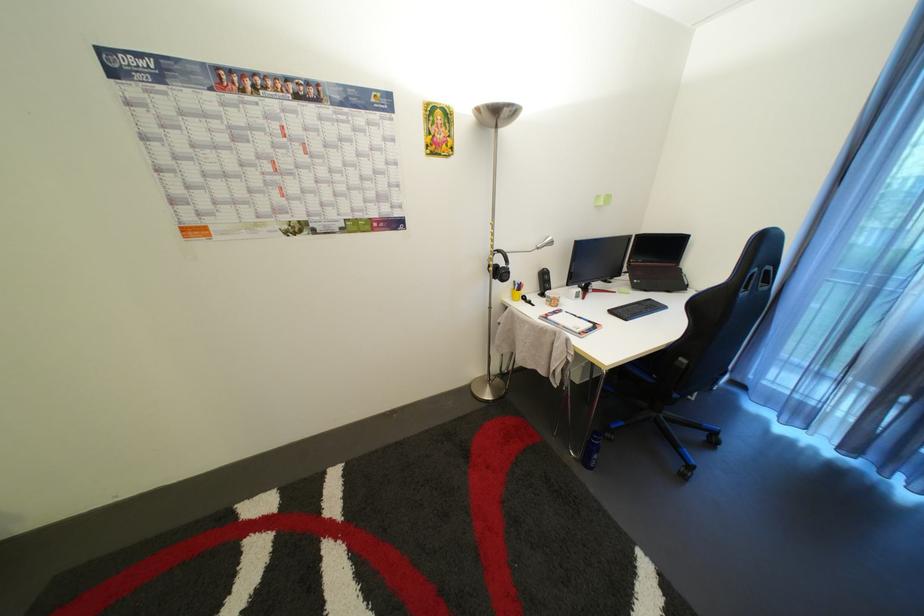
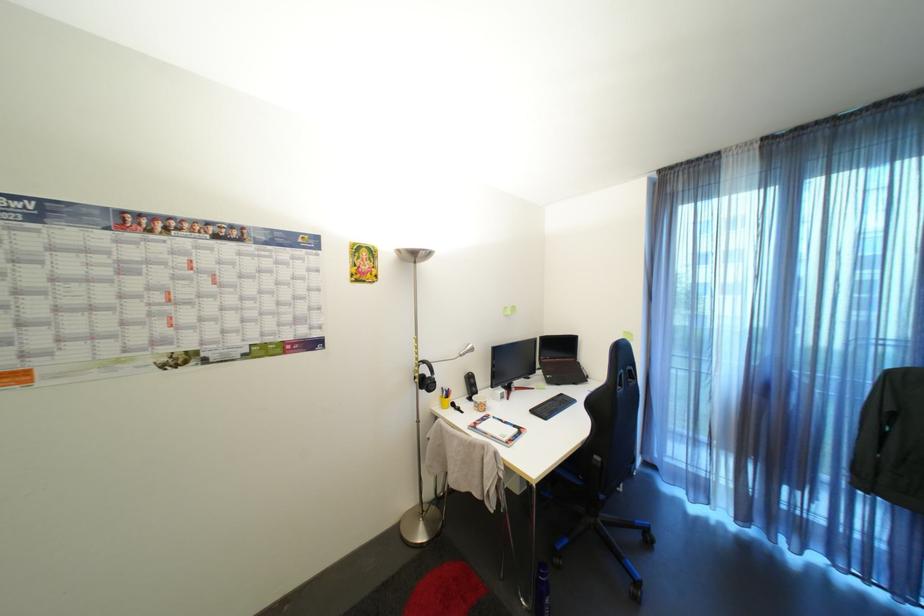
What movement of the cameraman would produce the second image?

The movement direction of the cameraman is right, backward.